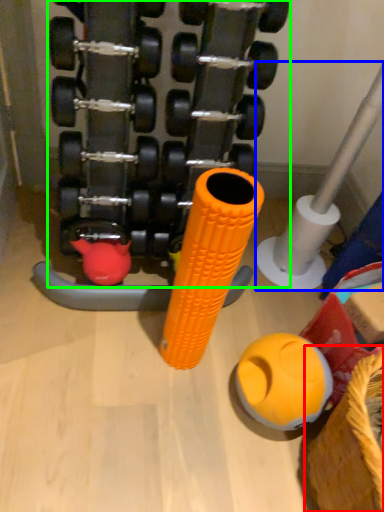
Question: Which is nearer to the basket (highlighted by a red box)? pipe (highlighted by a blue box) or dumbbell (highlighted by a green box).

Choices:
 (A) pipe
 (B) dumbbell

Answer: (A)